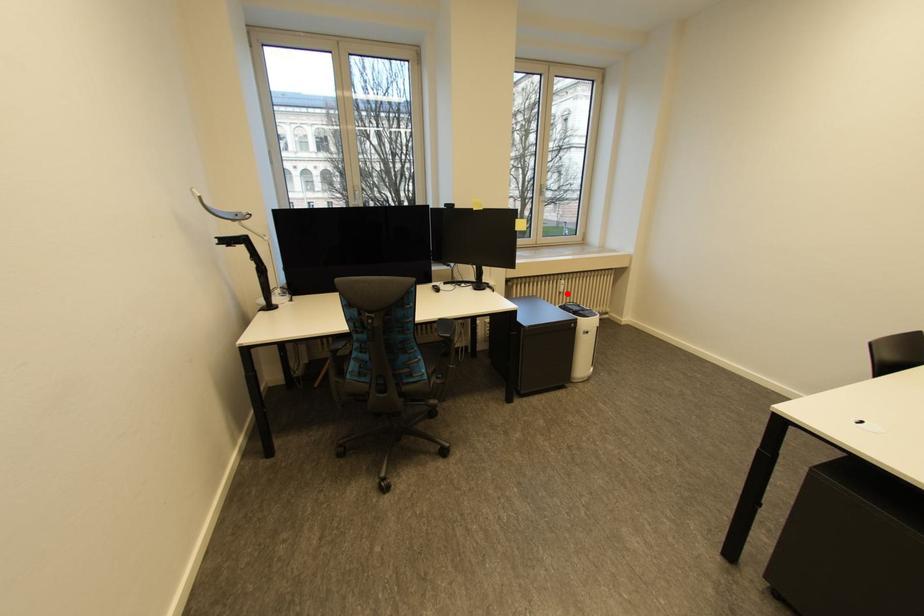
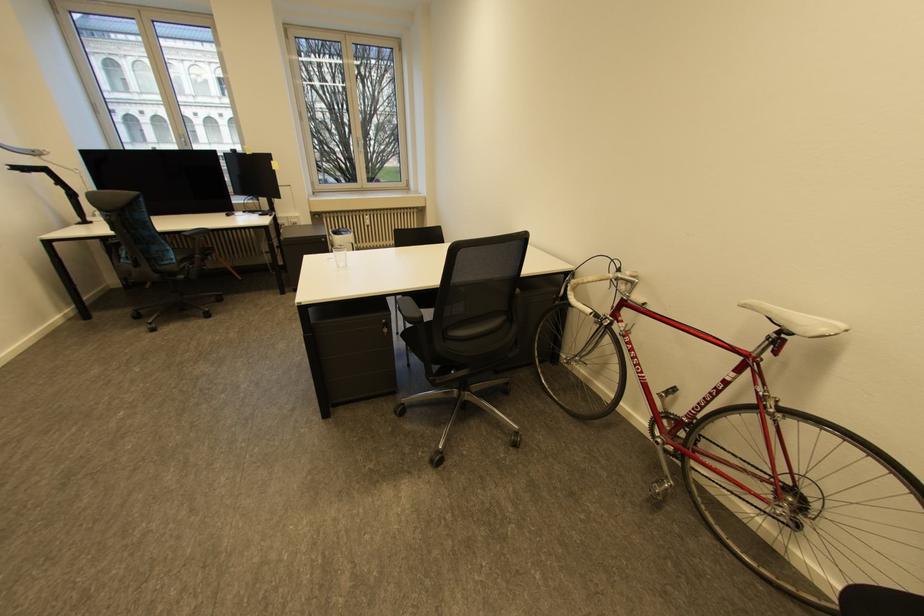
The point at the highlighted location is marked in the first image. Where is the corresponding point in the second image?

(374, 227)